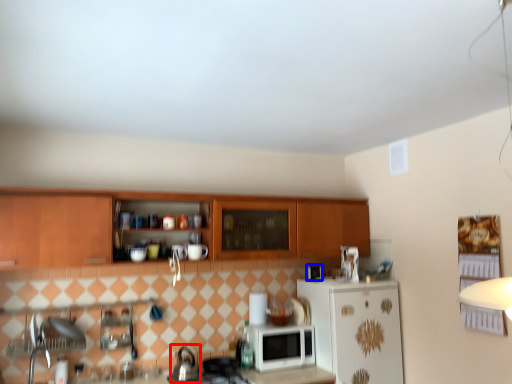
Question: Which of the following is the closest to the observer, tea pot (highlighted by a red box) or appliance (highlighted by a blue box)?

Choices:
 (A) tea pot
 (B) appliance

Answer: (A)